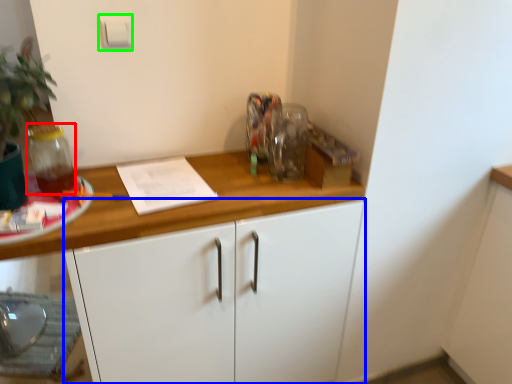
Question: Estimate the real-world distances between objects in this image. Which object is farther from glass jar (highlighted by a red box), cabinetry (highlighted by a blue box) or light switch (highlighted by a green box)?

Choices:
 (A) cabinetry
 (B) light switch

Answer: (A)